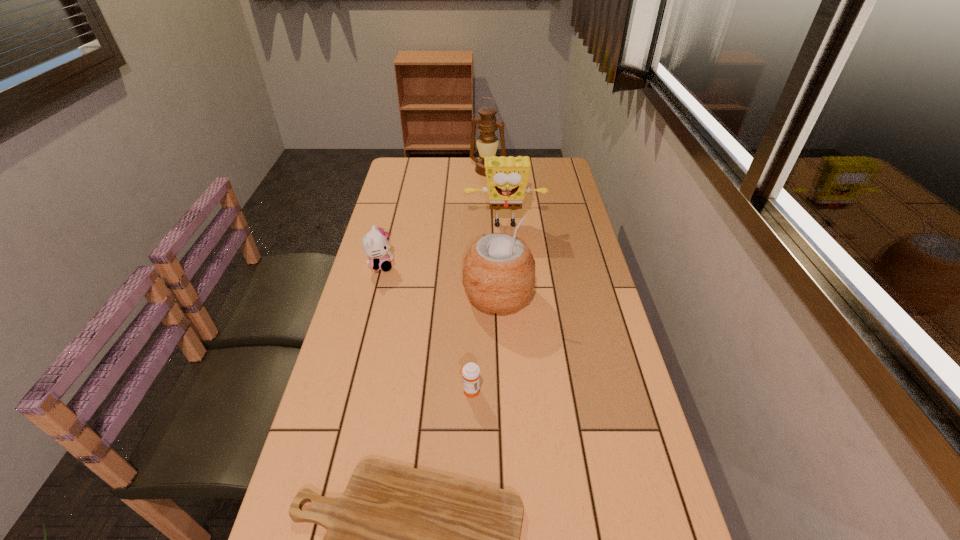
The height and width of the screenshot is (540, 960). What are the coordinates of `vacant space that is in between the coconut and the oil lamp` in the screenshot? It's located at (492, 233).

The width and height of the screenshot is (960, 540). Identify the location of object identified as the fourth closest to the fourth tallest object. (487, 142).

Locate which object ranks fourth in proximity to the kitten. Please provide its 2D coordinates. Your answer should be formatted as a tuple, i.e. [(x, y)], where the tuple contains the x and y coordinates of a point satisfying the conditions above.

[(487, 142)]

You are a GUI agent. You are given a task and a screenshot of the screen. Output one action in this format:
    pyautogui.click(x=<x>, y=<y>)
    Task: Click on the vacant region that satisfies the following two spatial constraints: 1. on the front-facing side of the medicine; 2. on the right side of the kitten
    
    Given the screenshot: What is the action you would take?
    pyautogui.click(x=348, y=391)

Where is `blank area in the image that satisfies the following two spatial constraints: 1. on the front-facing side of the kitten; 2. on the right side of the coconut`? The width and height of the screenshot is (960, 540). blank area in the image that satisfies the following two spatial constraints: 1. on the front-facing side of the kitten; 2. on the right side of the coconut is located at coordinates (372, 295).

Find the location of a particular element. free space that satisfies the following two spatial constraints: 1. on the front-facing side of the fourth tallest object; 2. on the right side of the coconut is located at coordinates (372, 295).

What are the coordinates of `free space that satisfies the following two spatial constraints: 1. on the front-facing side of the second shortest object; 2. on the left side of the kitten` in the screenshot? It's located at (348, 391).

Where is `free point that satisfies the following two spatial constraints: 1. on the back side of the second nearest object; 2. on the left side of the coconut`? The image size is (960, 540). free point that satisfies the following two spatial constraints: 1. on the back side of the second nearest object; 2. on the left side of the coconut is located at coordinates (472, 295).